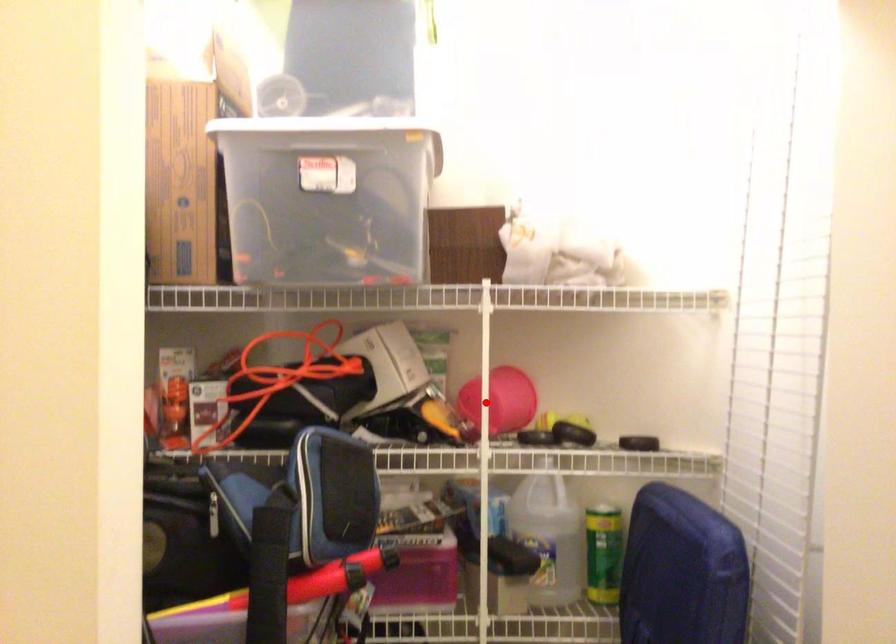
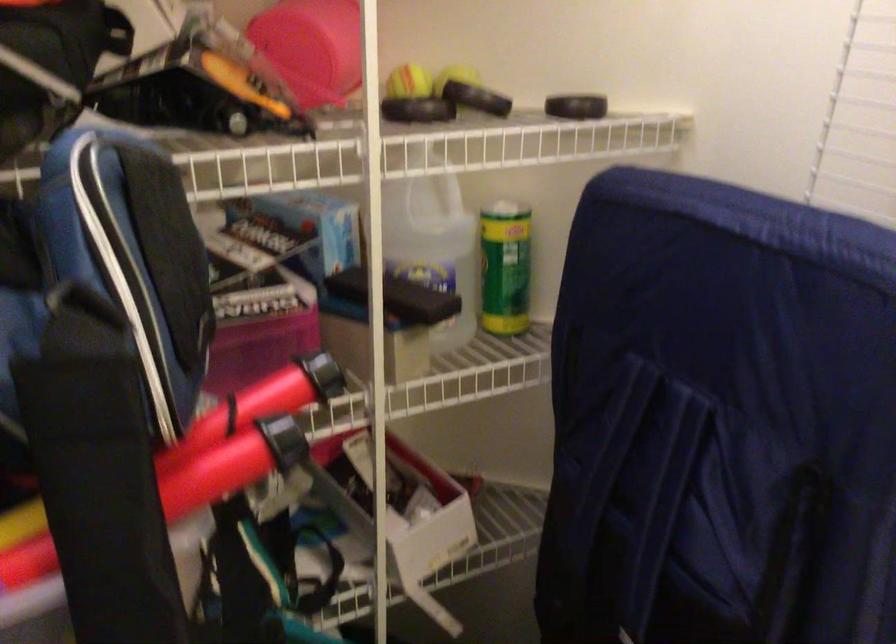
Question: A red point is marked in image1. In image2, is the corresponding 3D point closer to the camera or farther? Reply with the corresponding letter.

Choices:
 (A) The corresponding 3D point is closer.
 (B) The corresponding 3D point is farther.

Answer: (A)